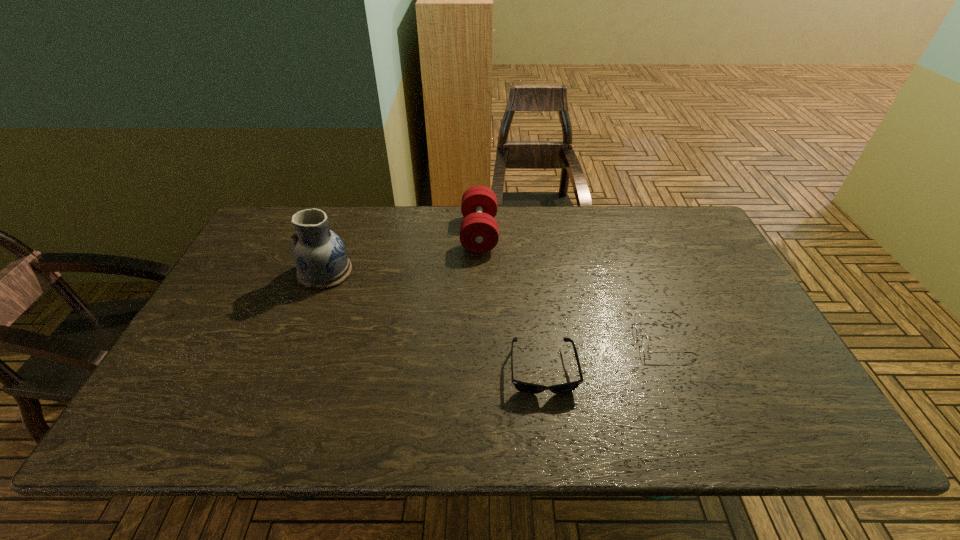
This screenshot has height=540, width=960. In order to click on vacant space located on the front-facing side of the rightmost object in this screenshot , I will do `click(594, 338)`.

This screenshot has width=960, height=540. Identify the location of vacant area located 0.280m on the front-facing side of the rightmost object. (527, 338).

Locate an element on the screen. object that is at the far edge is located at coordinates (479, 233).

Find the location of `vacant space at the far edge`. vacant space at the far edge is located at coordinates pos(617,238).

This screenshot has width=960, height=540. I want to click on vacant space at the near edge of the desktop, so click(505, 420).

This screenshot has width=960, height=540. I want to click on vacant space at the left edge of the desktop, so click(x=249, y=274).

Find the location of `free space at the right edge of the desktop`. free space at the right edge of the desktop is located at coordinates (722, 285).

In the image, there is a desktop. Identify the location of vacant area at the far left corner. This screenshot has width=960, height=540. (301, 210).

In order to click on vacant space at the far right corner of the desktop in this screenshot , I will do `click(689, 251)`.

The image size is (960, 540). Identify the location of vacant area that lies between the dumbbell and the second object from right to left. (511, 302).